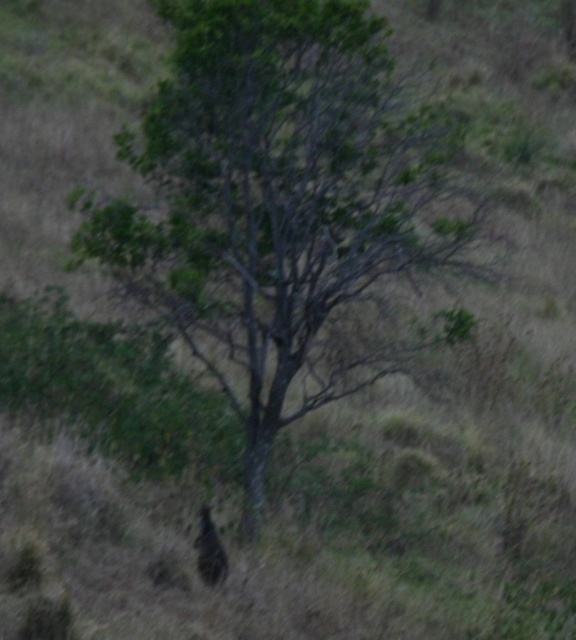
Does green leafy tree at center have a larger size compared to brown furry animal at lower center?

No, green leafy tree at center is not bigger than brown furry animal at lower center.

Can you confirm if green leafy tree at center is shorter than brown furry animal at lower center?

Indeed, green leafy tree at center has a lesser height compared to brown furry animal at lower center.

Does point (218, 188) come farther from viewer compared to point (210, 554)?

Yes, point (218, 188) is farther from viewer.

Image resolution: width=576 pixels, height=640 pixels. In order to click on green leafy tree at center in this screenshot , I will do `click(282, 204)`.